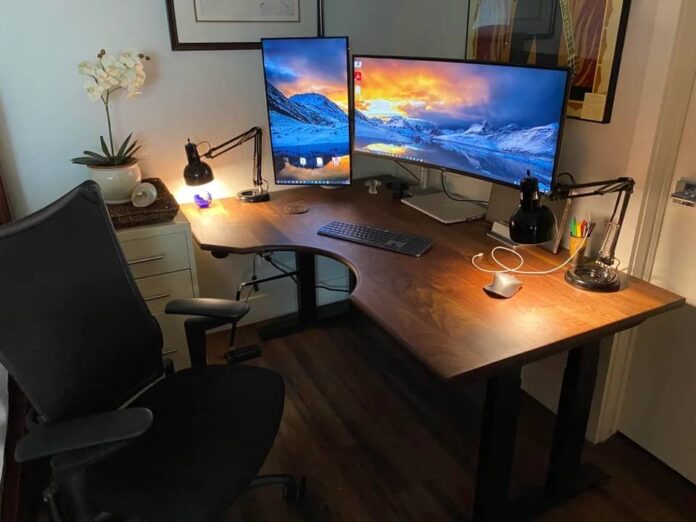
The height and width of the screenshot is (522, 696). Identify the location of lamp. (x=534, y=224), (x=200, y=164).